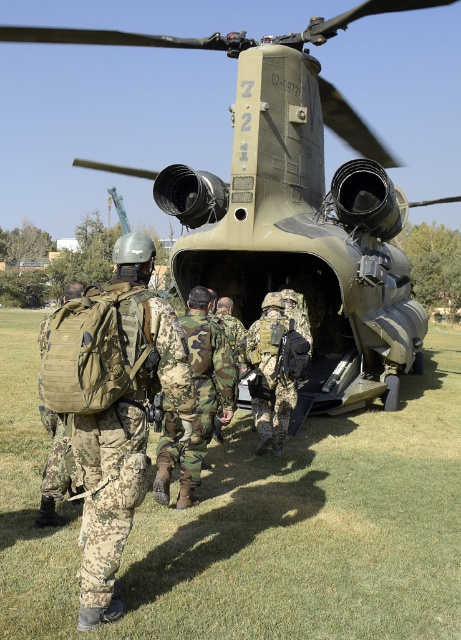
In the scene shown: You are a soldier approaching the helicopter. There are two points marked on the ground ahead of you at coordinates point (102, 545) and point (49, 417). Which point should you step on first to reach the helicopter?

You should step on point (102, 545) first because it is in front of point (49, 417), meaning it is closer to the helicopter.

You are a soldier carrying the camouflage fabric backpack at left and need to board the matte green helicopter at center. Can you reach the helicopter from your current position without moving the backpack?

The matte green helicopter at center is located above the camouflage fabric backpack at left, so you can reach it by moving upward from your current position.